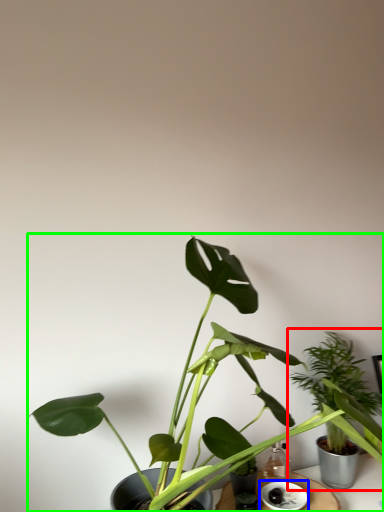
Question: Considering the real-world distances, which object is farthest from houseplant (highlighted by a red box)? saucer (highlighted by a blue box) or houseplant (highlighted by a green box)?

Choices:
 (A) saucer
 (B) houseplant

Answer: (A)